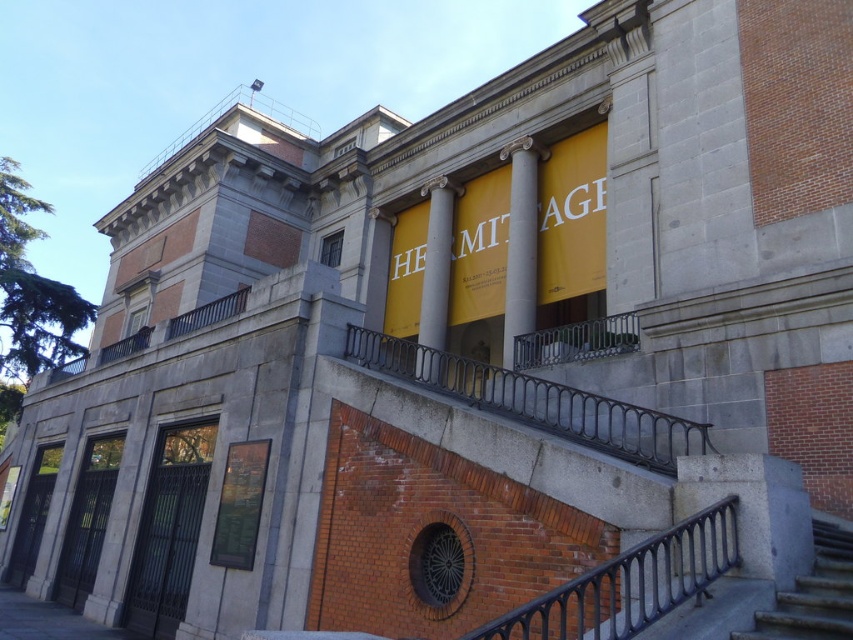
You are standing in front of the building and want to touch both the black metal balustrade at center and the gray stone column at center. Which object will you reach first?

You will reach the black metal balustrade at center first because it is closer to you than the gray stone column at center.

You are standing at the entrance of the building and want to reach the balcony above. The smooth concrete stairs at lower right and the gray stone column at center are in your view. Which object is shorter in height?

The smooth concrete stairs at lower right is not as tall as the gray stone column at center, so the smooth concrete stairs at lower right is shorter in height.

You are a visitor standing at the entrance of the museum. You notice the gray stone column at center and the white marble pillar at center. Which one is closer to you?

The gray stone column at center is 18.07 feet away from the white marble pillar at center, so they are both equidistant from you since they are positioned at the center of the facade.